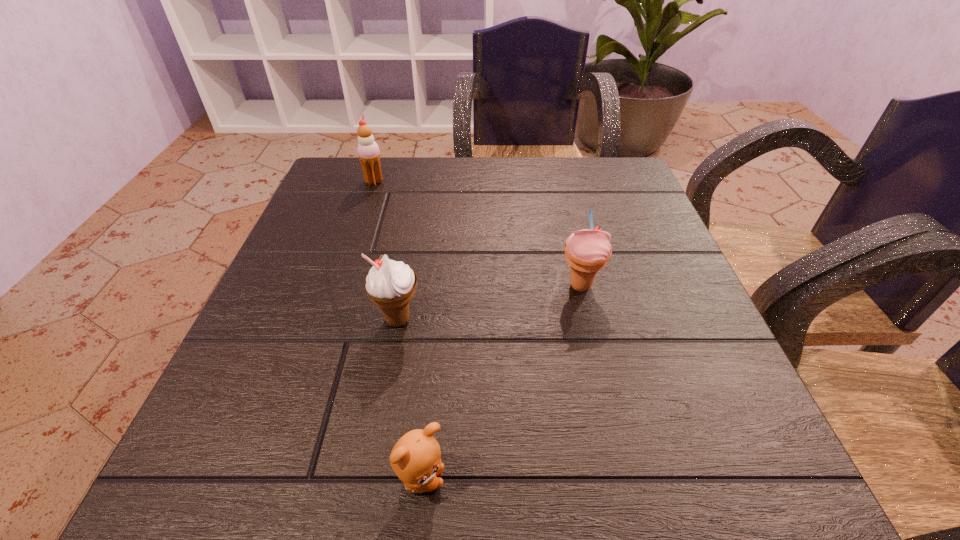
Locate an element on the screen. This screenshot has height=540, width=960. vacant space at the right edge of the desktop is located at coordinates (671, 339).

The height and width of the screenshot is (540, 960). I want to click on vacant space at the near left corner, so click(x=207, y=462).

Image resolution: width=960 pixels, height=540 pixels. I want to click on vacant space at the far right corner, so click(640, 196).

Find the location of `free space that is in between the farthest object and the teddy bear`. free space that is in between the farthest object and the teddy bear is located at coordinates (397, 330).

Where is `free spot between the second farthest object and the shortest object`? This screenshot has height=540, width=960. free spot between the second farthest object and the shortest object is located at coordinates (500, 382).

Find the location of a particular element. This screenshot has height=540, width=960. empty location between the shortest object and the leftmost object is located at coordinates (397, 330).

Image resolution: width=960 pixels, height=540 pixels. I want to click on free space between the nearest icecream and the second farthest icecream, so click(x=489, y=303).

Where is `unoccupied position between the teddy bear and the nearest icecream`? unoccupied position between the teddy bear and the nearest icecream is located at coordinates (409, 400).

This screenshot has width=960, height=540. What are the coordinates of `free space between the second icecream from left to right and the rightmost object` in the screenshot? It's located at (489, 303).

You are a GUI agent. You are given a task and a screenshot of the screen. Output one action in this format:
    pyautogui.click(x=<x>, y=<y>)
    Task: Click on the empty space between the leftmost object and the second farthest icecream
    The image size is (960, 540).
    Given the screenshot: What is the action you would take?
    pyautogui.click(x=477, y=233)